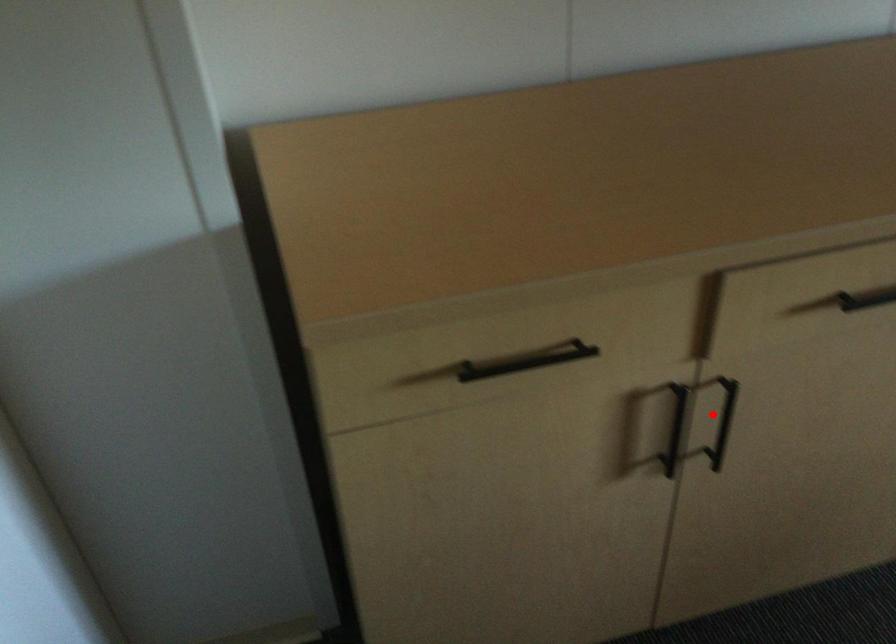
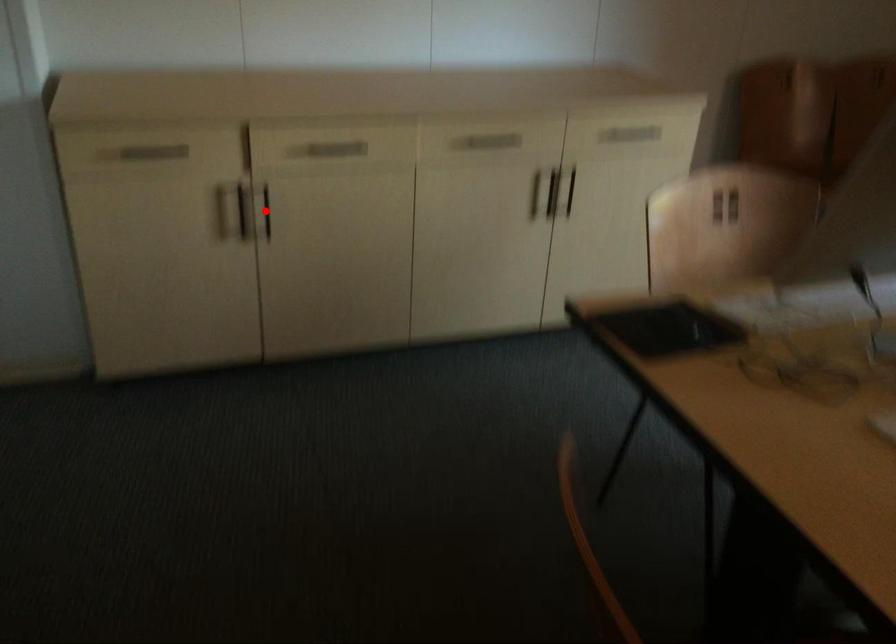
I am providing you with two images of the same scene from different viewpoints. A red point is marked on the first image and another point is marked on the second image. Is the red point in image1 aligned with the point shown in image2?

Yes